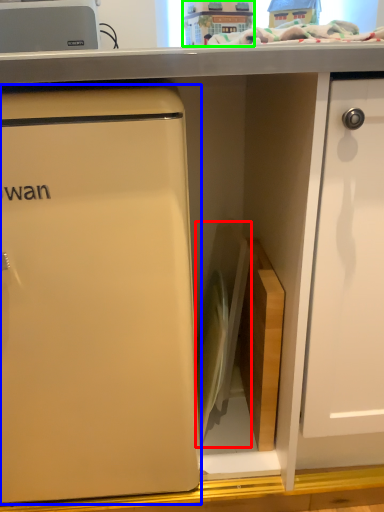
Question: Considering the real-world distances, which object is farthest from appliance (highlighted by a red box)? refrigerator (highlighted by a blue box) or toy (highlighted by a green box)?

Choices:
 (A) refrigerator
 (B) toy

Answer: (B)